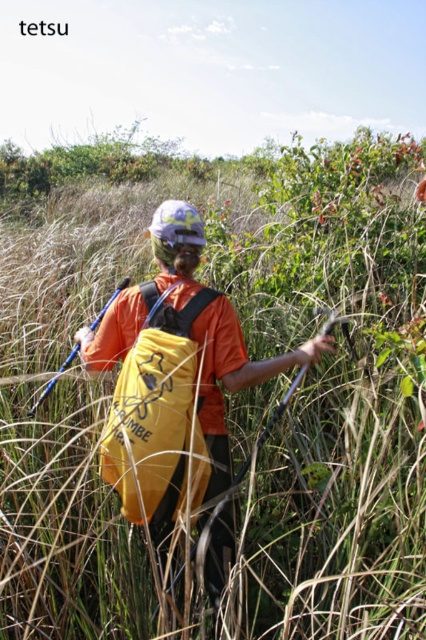
Which is behind, point (120, 307) or point (112, 333)?

Positioned behind is point (120, 307).

Is yellow matte backpack at center below yellow fabric backpack at center?

Indeed, yellow matte backpack at center is positioned under yellow fabric backpack at center.

Which is in front, point (135, 368) or point (181, 376)?

Point (135, 368)

This screenshot has height=640, width=426. Find the location of `yellow matte backpack at center`. yellow matte backpack at center is located at coordinates (173, 381).